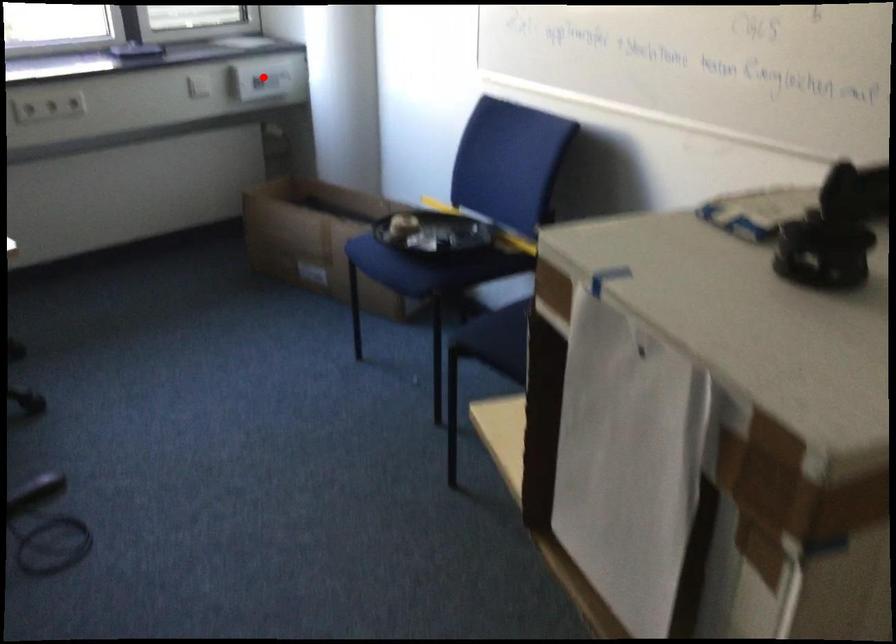
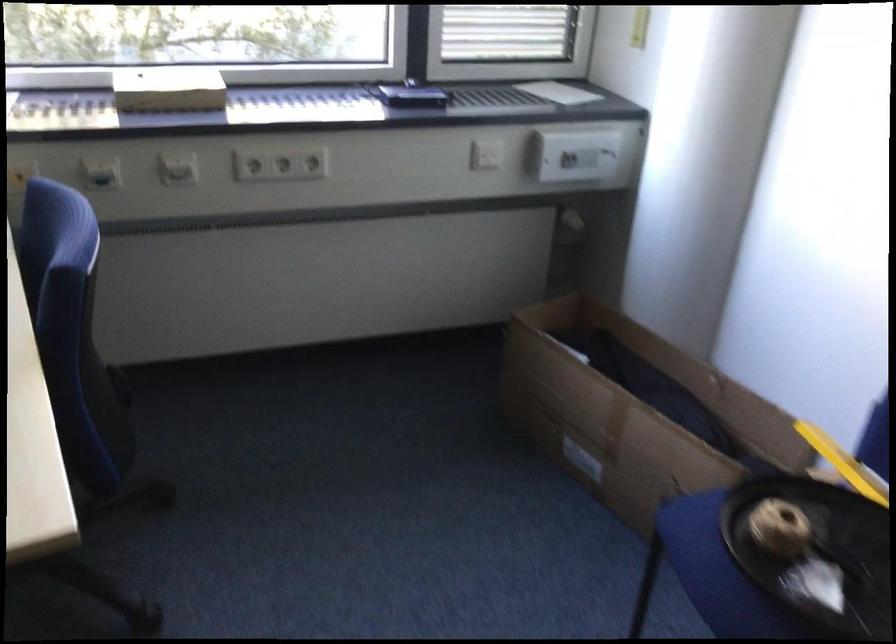
Question: I am providing you with two images of the same scene from different viewpoints. Image1 has a red point marked. In image2, the corresponding 3D location appears at what relative position? Reply with the corresponding letter.

Choices:
 (A) Closer
 (B) Farther

Answer: (A)